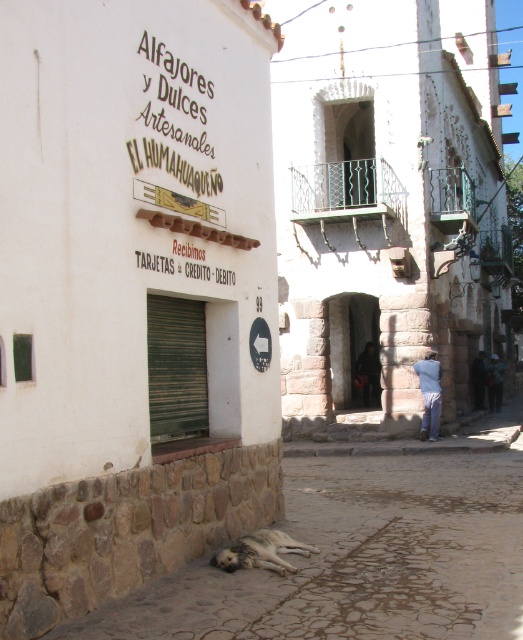
Does gray cobblestone pavement at lower center appear over brown fur dog at lower center?

Incorrect, gray cobblestone pavement at lower center is not positioned above brown fur dog at lower center.

Does gray cobblestone pavement at lower center have a larger size compared to brown fur dog at lower center?

No, gray cobblestone pavement at lower center is not bigger than brown fur dog at lower center.

The width and height of the screenshot is (523, 640). What do you see at coordinates (358, 560) in the screenshot?
I see `gray cobblestone pavement at lower center` at bounding box center [358, 560].

Find the location of `gray cobblestone pavement at lower center`. gray cobblestone pavement at lower center is located at coordinates (358, 560).

Does point (300, 557) lie in front of point (436, 371)?

Yes, point (300, 557) is closer to viewer.

Can you confirm if gray cobblestone pavement at lower center is smaller than blue jeans at lower right?

Yes.

Measure the distance between point [423,579] and camera.

A distance of 6.24 meters exists between point [423,579] and camera.

Where is `gray cobblestone pavement at lower center`? gray cobblestone pavement at lower center is located at coordinates [358, 560].

Which is below, brown fur dog at lower center or blue jeans at lower right?

Positioned lower is brown fur dog at lower center.

This screenshot has width=523, height=640. What do you see at coordinates (260, 552) in the screenshot?
I see `brown fur dog at lower center` at bounding box center [260, 552].

What do you see at coordinates (260, 552) in the screenshot? I see `brown fur dog at lower center` at bounding box center [260, 552].

This screenshot has height=640, width=523. I want to click on brown fur dog at lower center, so click(260, 552).